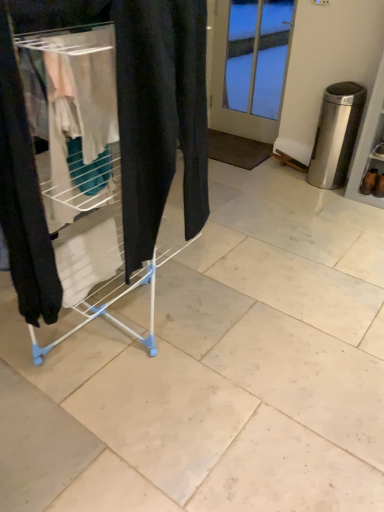
Locate an element on the screen. Image resolution: width=384 pixels, height=512 pixels. free location in front of white plastic drying rack at left is located at coordinates tap(117, 437).